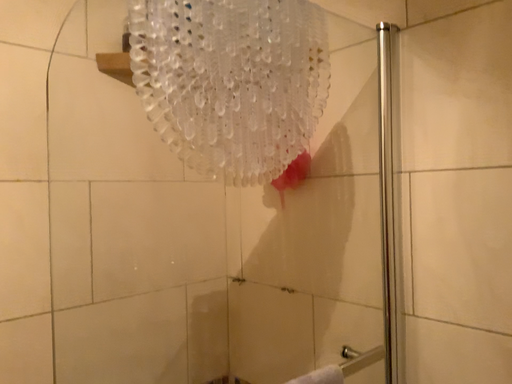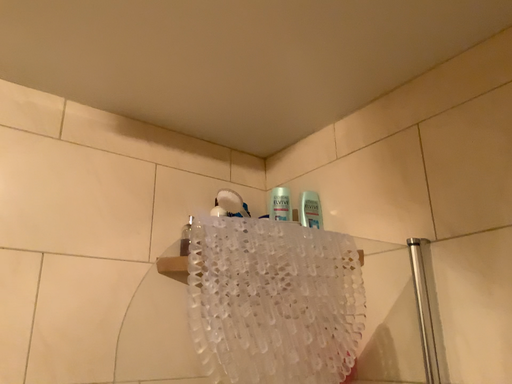
Question: Which way did the camera rotate in the video?

Choices:
 (A) rotated left
 (B) rotated right

Answer: (A)